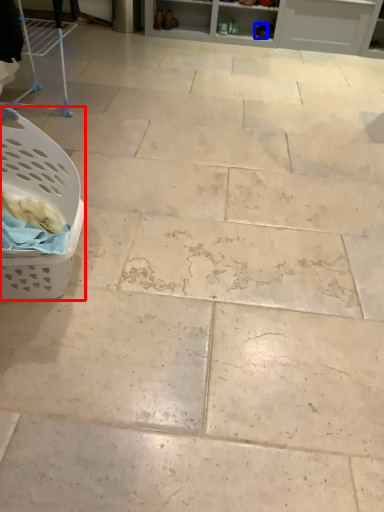
Question: Which of the following is the farthest to the observer, basket (highlighted by a red box) or footwear (highlighted by a blue box)?

Choices:
 (A) basket
 (B) footwear

Answer: (B)